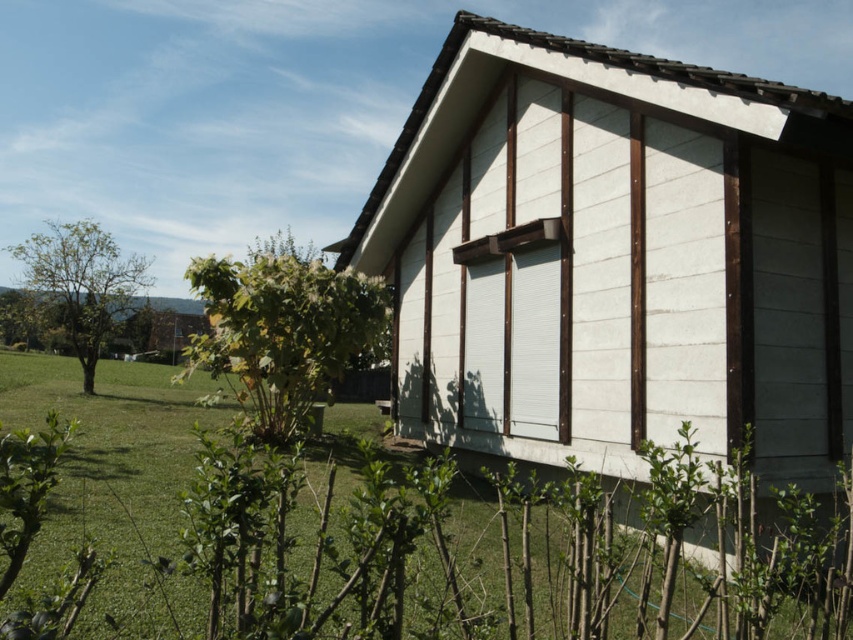
Consider the image. Does white wood hut at center appear over green grass at lower left?

Yes, white wood hut at center is above green grass at lower left.

Is white wood hut at center positioned before green grass at lower left?

That is False.

This screenshot has width=853, height=640. Find the location of `white wood hut at center`. white wood hut at center is located at coordinates (614, 257).

The image size is (853, 640). What are the coordinates of `white wood hut at center` in the screenshot? It's located at (614, 257).

Does green grass at lower left have a lesser width compared to green leafy tree at center?

No, green grass at lower left is not thinner than green leafy tree at center.

Between green grass at lower left and green leafy tree at center, which one appears on the left side from the viewer's perspective?

green leafy tree at center is more to the left.

Locate an element on the screen. This screenshot has width=853, height=640. green grass at lower left is located at coordinates (433, 540).

Is green grass at lower left taller than white matte window at center?

In fact, green grass at lower left may be shorter than white matte window at center.

From the picture: Does green grass at lower left have a smaller size compared to white matte window at center?

No.

This screenshot has height=640, width=853. In order to click on green grass at lower left in this screenshot , I will do `click(433, 540)`.

What are the coordinates of `green grass at lower left` in the screenshot? It's located at (433, 540).